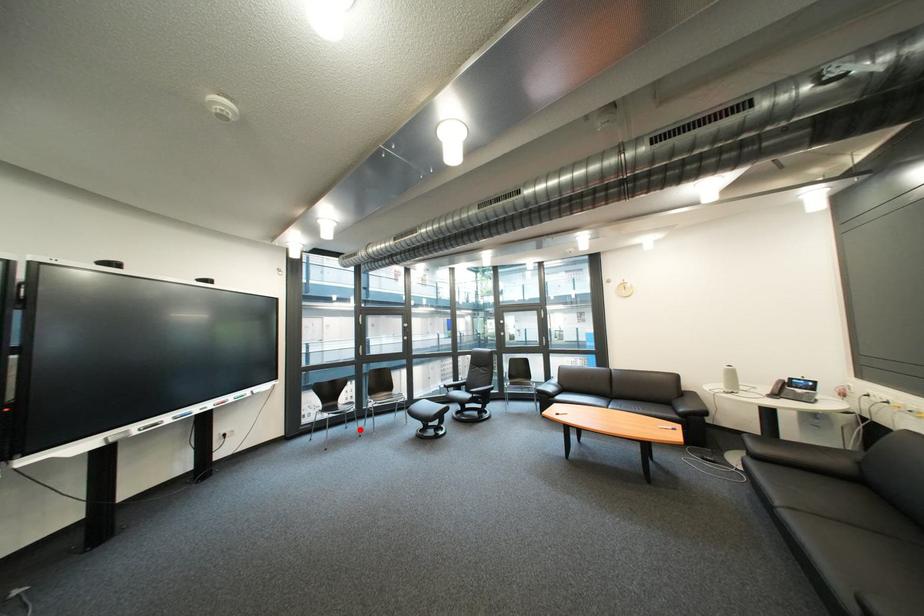
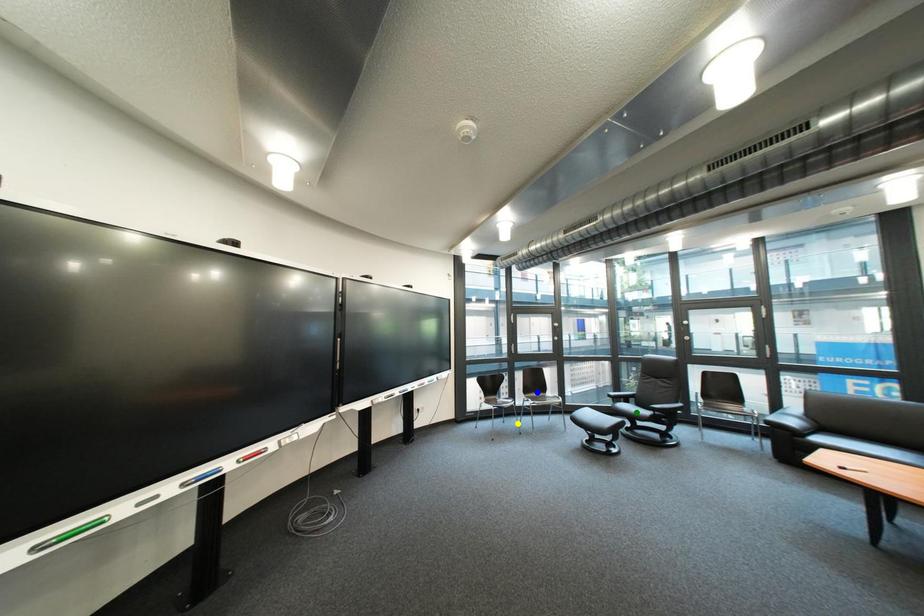
Question: I am providing you with two images of the same scene from different viewpoints. A red point is marked on the first image. You are given multiple points on the second image. Can you choose the point in image 2 that corresponds to the point in image 1?

Choices:
 (A) green point
 (B) blue point
 (C) yellow point

Answer: (C)